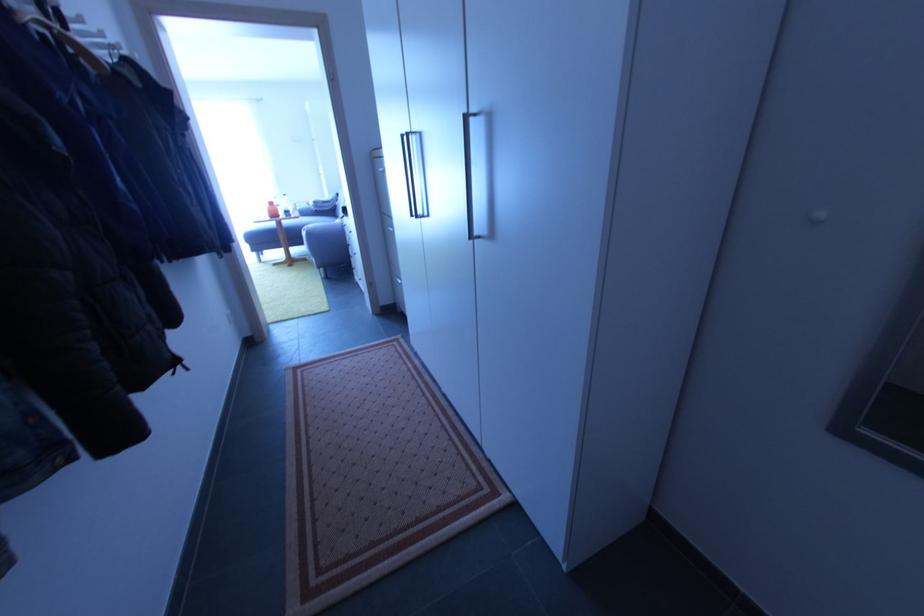
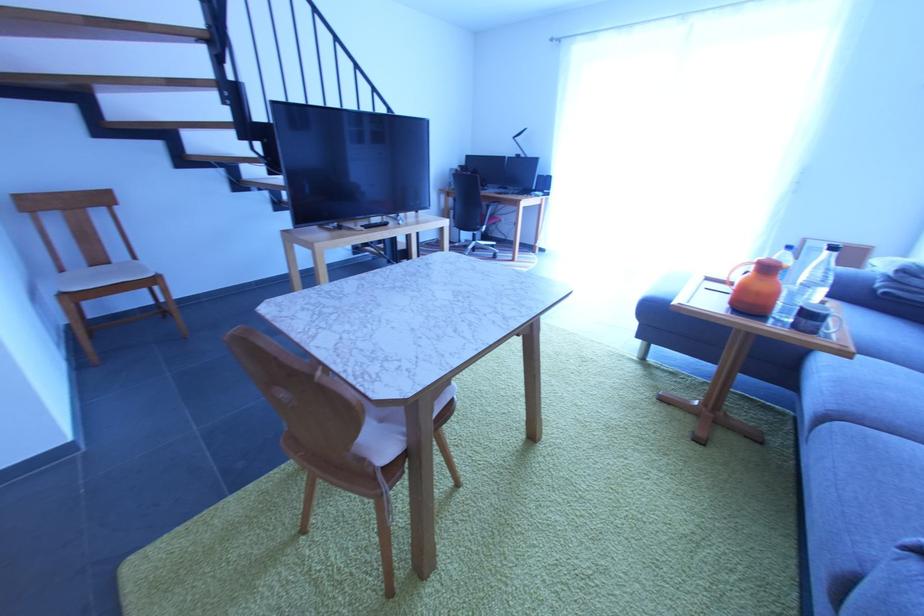
Locate, in the second image, the point that corresponds to point (295, 217) in the first image.

(819, 334)